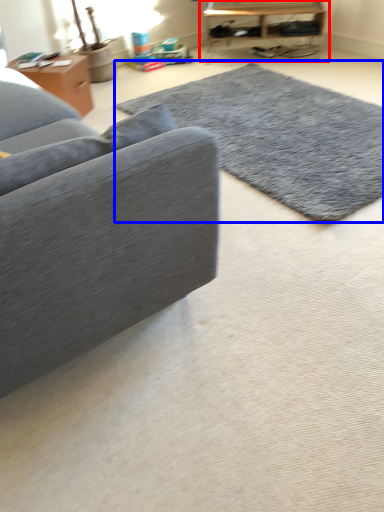
Question: Which object is further to the camera taking this photo, table (highlighted by a red box) or mat (highlighted by a blue box)?

Choices:
 (A) table
 (B) mat

Answer: (A)